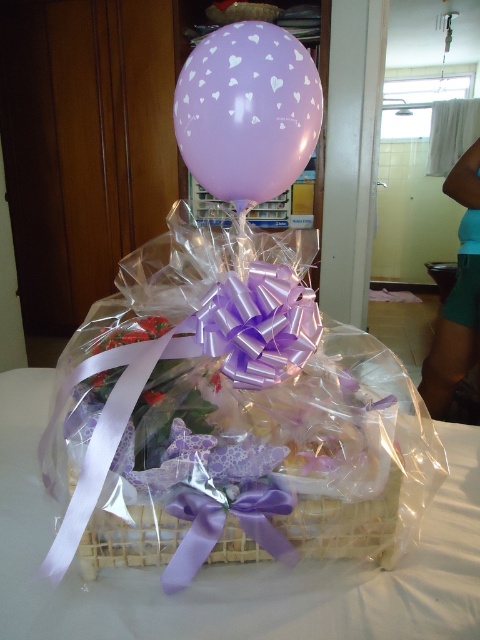
From the picture: You are holding a small gift that is 3 inches wide and want to place it on the translucent plastic basket at center. Is there enough space on the basket to place it?

The translucent plastic basket at center and viewer are 17.06 inches apart from each other. Since the gift is only 3 inches wide, there should be sufficient space to place it on the basket.

You are at a party and need to retrieve the lavender matte balloon at upper center from the translucent plastic basket at center. Can you reach it without moving the basket?

The lavender matte balloon at upper center is above the translucent plastic basket at center, so you can reach it without moving the basket.